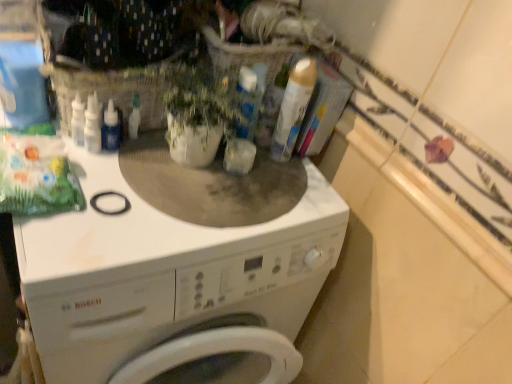
The height and width of the screenshot is (384, 512). Identify the location of vacant area that is in front of transparent plastic bottle at center. (98, 203).